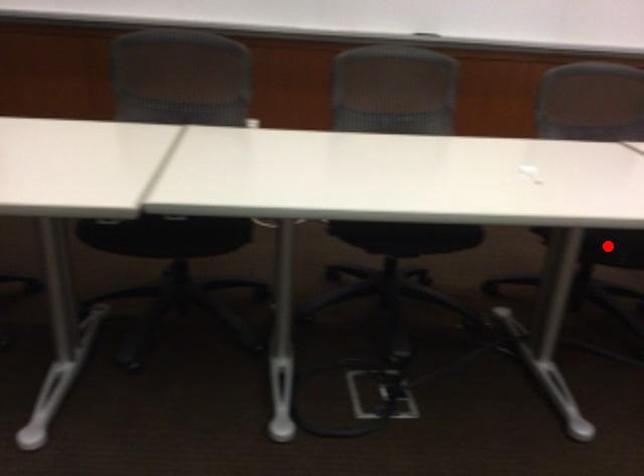
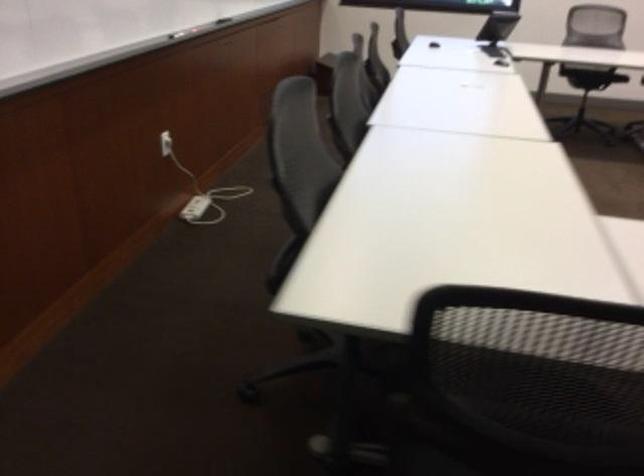
Question: I am providing you with two images of the same scene from different viewpoints. A red point is marked on the first image. At the location where the point appears in image 1, is it still visible in image 2?

Choices:
 (A) Yes
 (B) No

Answer: (B)